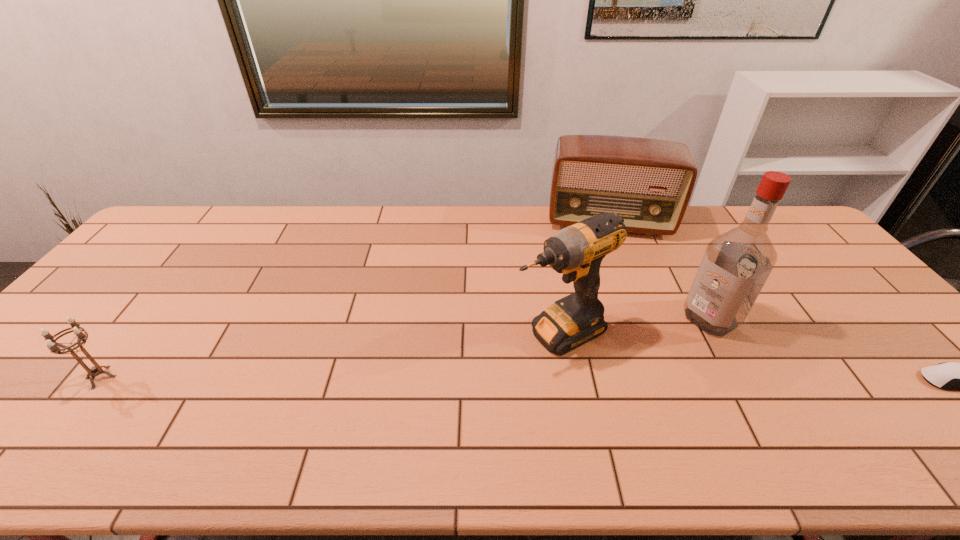
I want to click on free space on the desktop that is between the second shortest object and the shortest object and is positioned on the front-facing side of the radio receiver, so click(x=621, y=379).

Identify the location of vacant space on the desktop that is between the candle holder and the rightmost object and is positioned with the drill bit of the drill facing forward. (467, 379).

Where is `vacant space on the desktop that is between the fourth tallest object and the mouse and is positioned on the front-facing side of the liquor`? This screenshot has height=540, width=960. vacant space on the desktop that is between the fourth tallest object and the mouse and is positioned on the front-facing side of the liquor is located at coordinates (613, 379).